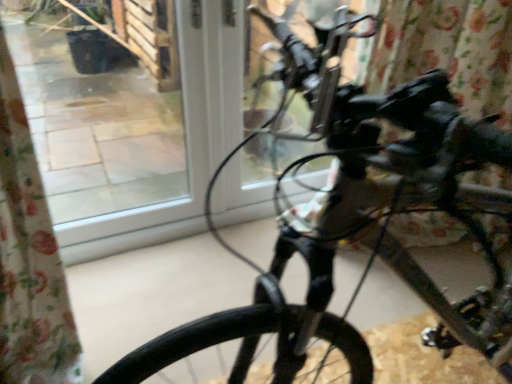
Image resolution: width=512 pixels, height=384 pixels. Describe the element at coordinates (99, 137) in the screenshot. I see `transparent glass window at center` at that location.

Where is `transparent glass window at center`? This screenshot has height=384, width=512. transparent glass window at center is located at coordinates 99,137.

What is the approximate width of transparent glass window at center?

transparent glass window at center is 4.23 inches in width.

The height and width of the screenshot is (384, 512). What are the coordinates of `transparent glass window at center` in the screenshot? It's located at (99, 137).